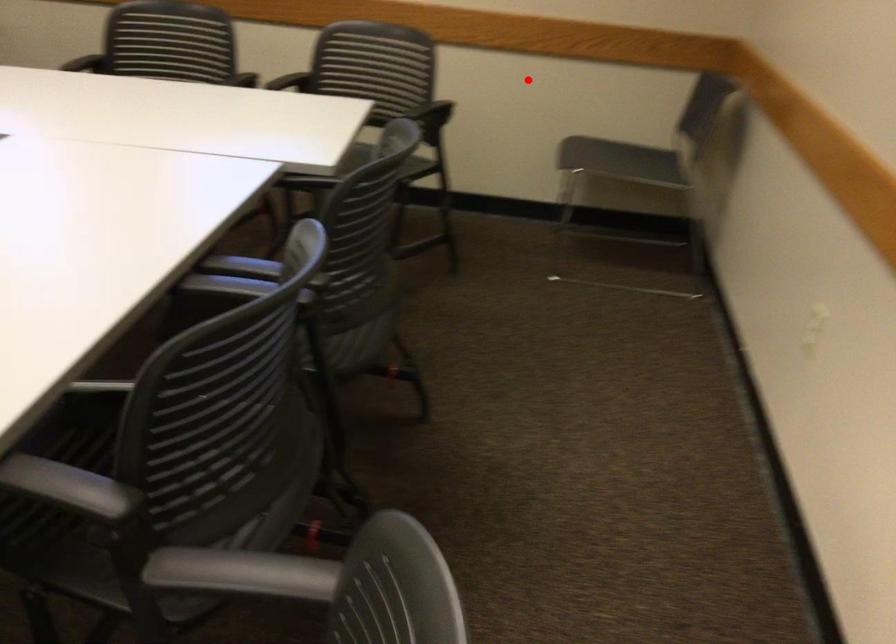
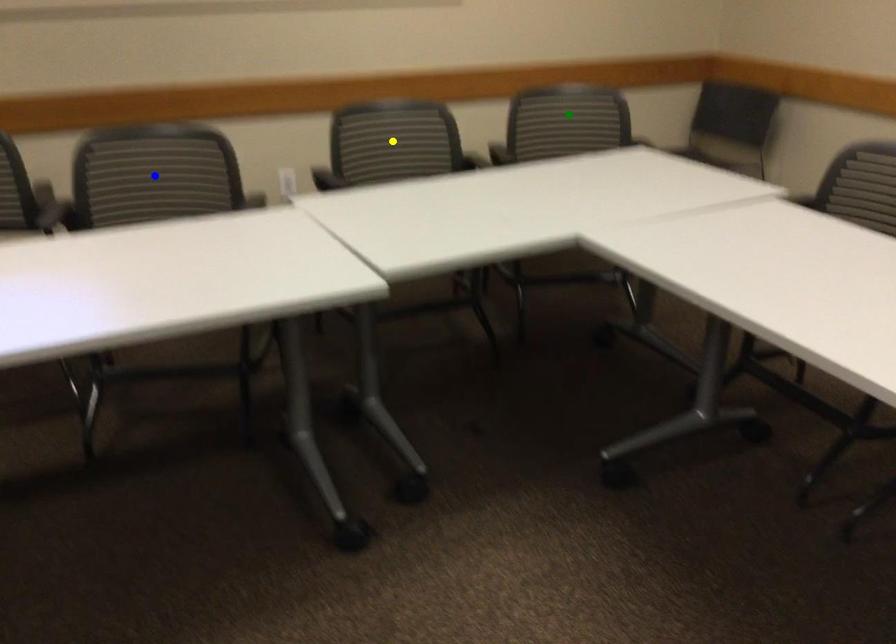
Question: I am providing you with two images of the same scene from different viewpoints. A red point is marked on the first image. You are given multiple points on the second image. Which spot in image 2 lines up with the point in image 1?

Choices:
 (A) green point
 (B) yellow point
 (C) blue point

Answer: (A)